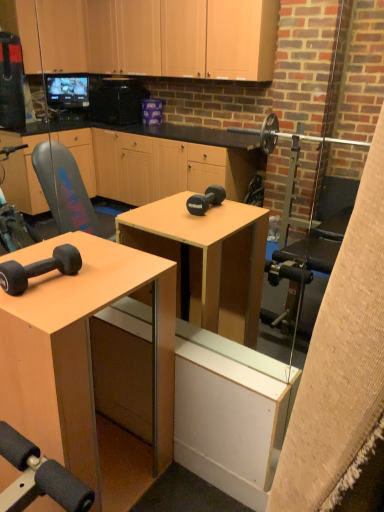
What are the coordinates of `empty space that is to the right of matte black dumbbell at lower left` in the screenshot? It's located at (96, 282).